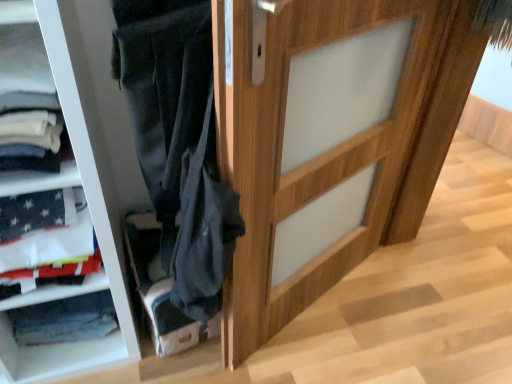
Where is `vacant space in front of wooden door at center`? vacant space in front of wooden door at center is located at coordinates (322, 351).